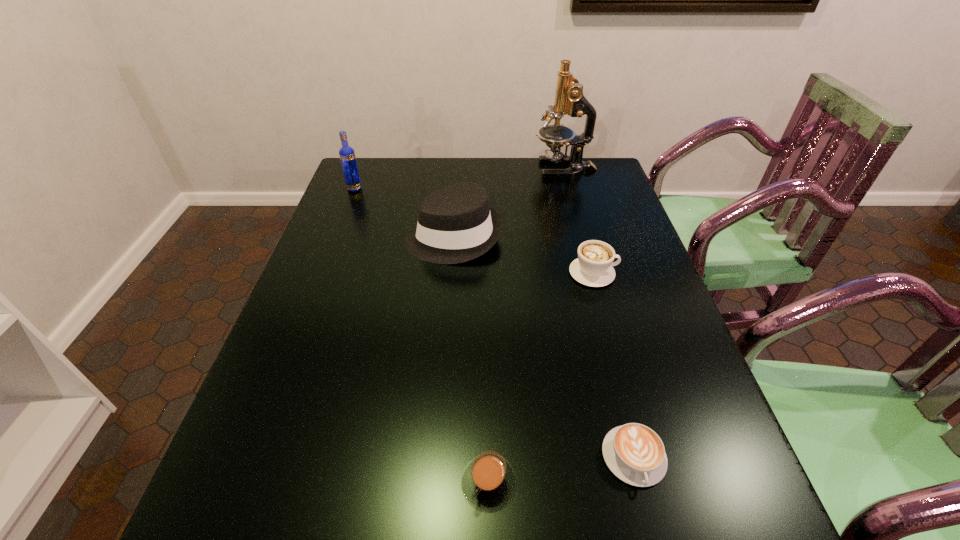
Find the location of a particular element. vacant area located at the eyepiece of the farthest object is located at coordinates (499, 169).

Locate an element on the screen. The image size is (960, 540). free space located at the eyepiece of the farthest object is located at coordinates (502, 169).

Where is `free spot located at the eyepiece of the farthest object`? Image resolution: width=960 pixels, height=540 pixels. free spot located at the eyepiece of the farthest object is located at coordinates (448, 169).

This screenshot has width=960, height=540. Find the location of `vacant region located on the front of the fifth shortest object`. vacant region located on the front of the fifth shortest object is located at coordinates (336, 237).

Identify the location of free location located on the front of the fedora. The image size is (960, 540). (449, 299).

Where is `vacant space located 0.090m on the right of the second shortest cappuccino`? The height and width of the screenshot is (540, 960). vacant space located 0.090m on the right of the second shortest cappuccino is located at coordinates (566, 482).

Identify the location of microscope located at the far edge. The width and height of the screenshot is (960, 540). (569, 98).

You are a GUI agent. You are given a task and a screenshot of the screen. Output one action in this format:
    pyautogui.click(x=<x>, y=<y>)
    Task: Click on the vodka situated at the far edge
    The height and width of the screenshot is (540, 960).
    Given the screenshot: What is the action you would take?
    pyautogui.click(x=347, y=155)

Where is `object that is at the near edge`? This screenshot has width=960, height=540. object that is at the near edge is located at coordinates (488, 481).

Image resolution: width=960 pixels, height=540 pixels. I want to click on object situated at the left edge, so click(347, 155).